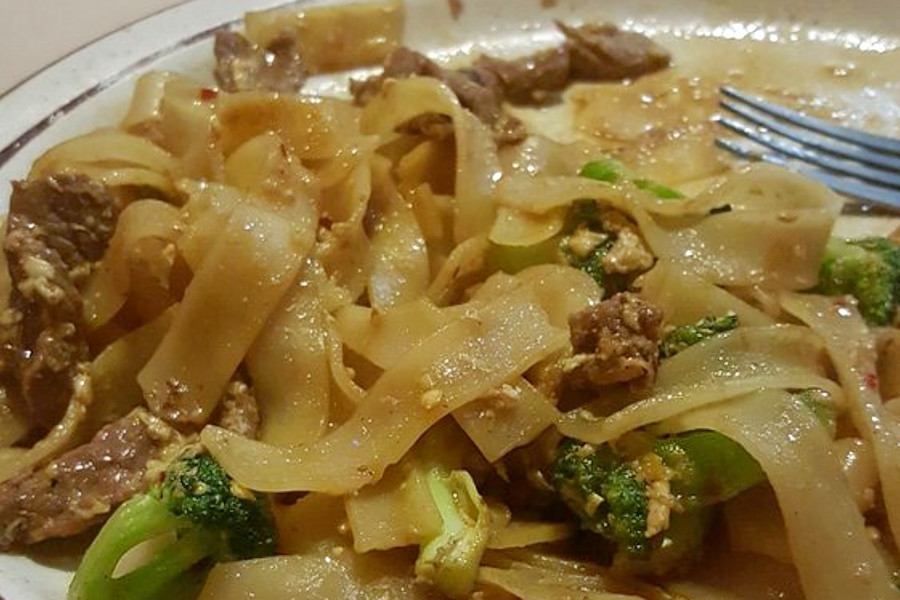
Where is `white round plate`? This screenshot has width=900, height=600. white round plate is located at coordinates (84, 61), (19, 595).